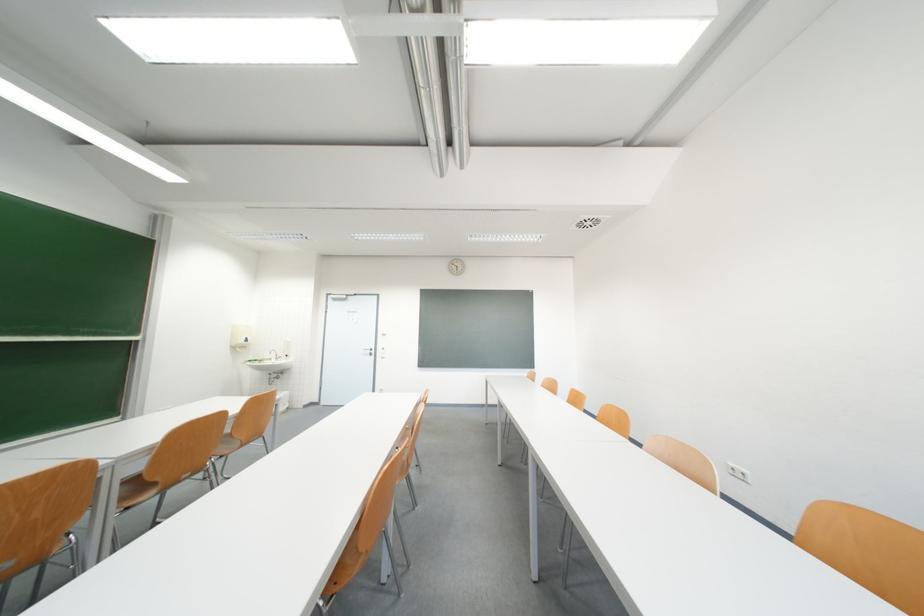
I want to click on dispenser lever, so click(239, 336).